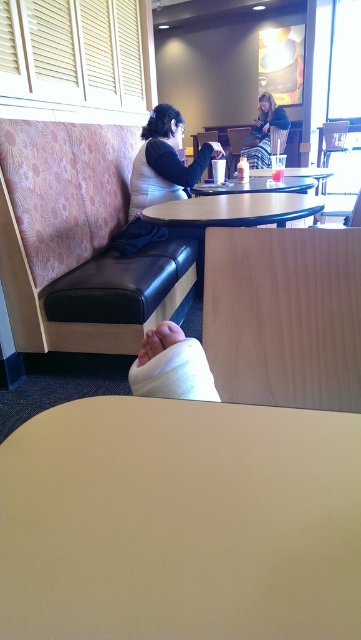
Who is taller, pink fabric couch at left or smooth white table at center?

pink fabric couch at left

Which is in front, point (93, 266) or point (158, 211)?

Point (158, 211)

Find the location of a particular element. The image size is (361, 640). pink fabric couch at left is located at coordinates (76, 234).

Who is positioned more to the left, smooth white table at center or plaid skirt at center?

smooth white table at center is more to the left.

Is smooth white table at center to the right of plaid skirt at center from the viewer's perspective?

Incorrect, smooth white table at center is not on the right side of plaid skirt at center.

I want to click on smooth white table at center, so click(x=236, y=209).

Between beige matte table at center and white plastic table at center, which one is positioned higher?

white plastic table at center is higher up.

The height and width of the screenshot is (640, 361). What do you see at coordinates (180, 522) in the screenshot? I see `beige matte table at center` at bounding box center [180, 522].

Find the location of a particular element. The height and width of the screenshot is (640, 361). beige matte table at center is located at coordinates (180, 522).

Find the location of a particular element. beige matte table at center is located at coordinates coord(180,522).